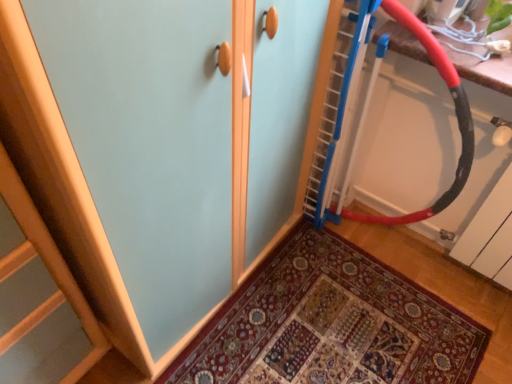
You are a GUI agent. You are given a task and a screenshot of the screen. Output one action in this format:
    pyautogui.click(x=<x>, y=<y>)
    Task: Click on the spots to the right of red rubber battle rope at upper right
    Image resolution: width=512 pixels, height=384 pixels.
    Given the screenshot: What is the action you would take?
    pyautogui.click(x=426, y=271)